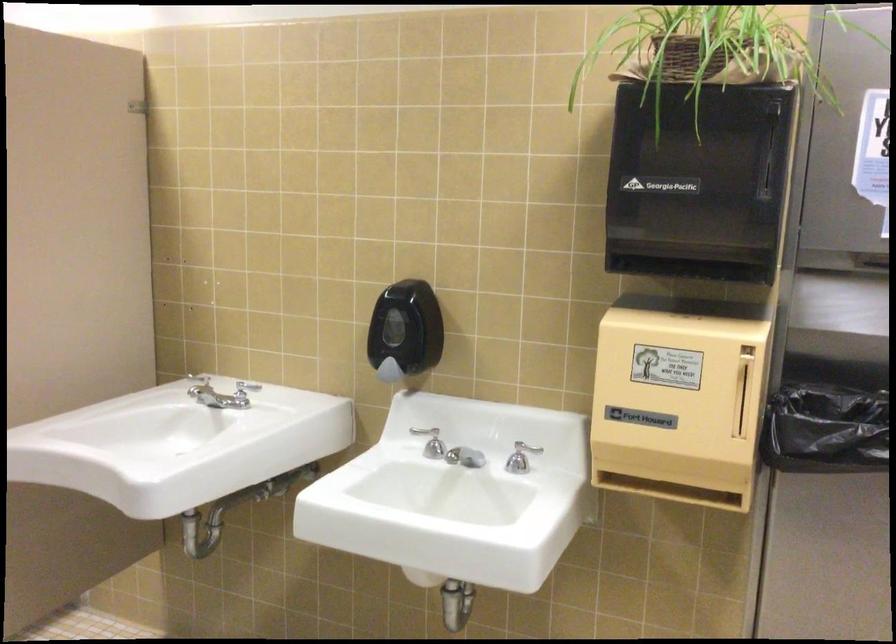
Locate an element on the screen. This screenshot has height=644, width=896. soap dispenser lever is located at coordinates (389, 371).